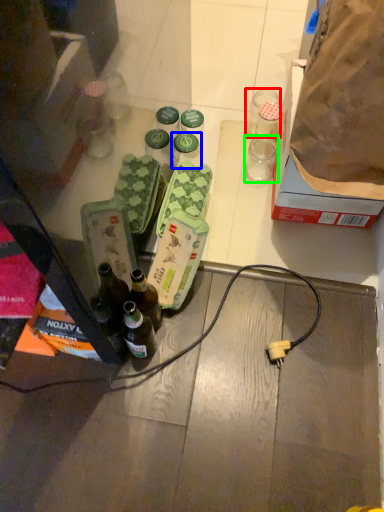
Question: Based on their relative distances, which object is nearer to coffee cup (highlighted by a red box)? Choose from bottle (highlighted by a blue box) and coffee cup (highlighted by a green box).

Choices:
 (A) bottle
 (B) coffee cup

Answer: (B)